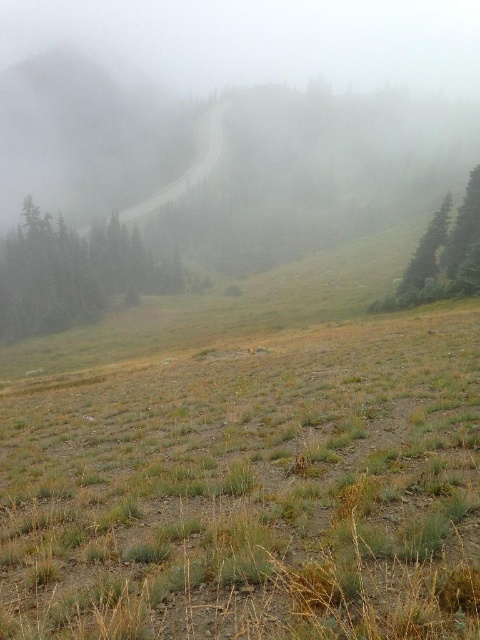
You are a hiker standing on the dry grass at lower center and want to reach the green matte tree at left. Which direction should you walk to get closer to the tree?

Since the dry grass at lower center has a lesser height compared to the green matte tree at left, you should walk towards the left direction to get closer to the green matte tree at left.